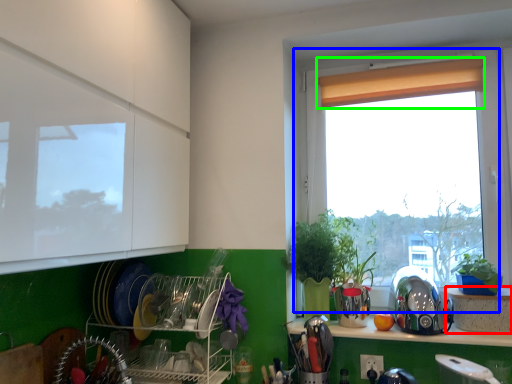
Question: Which is nearer to the cabinetry (highlighted by a red box)? window (highlighted by a blue box) or curtain (highlighted by a green box).

Choices:
 (A) window
 (B) curtain

Answer: (A)